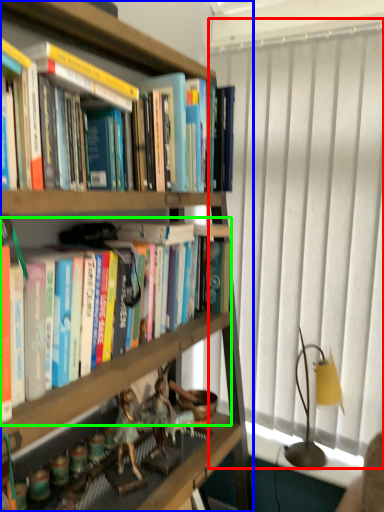
Question: Which object is positioned farthest from window screen (highlighted by a red box)? Select from bookcase (highlighted by a blue box) and book (highlighted by a green box).

Choices:
 (A) bookcase
 (B) book

Answer: (A)